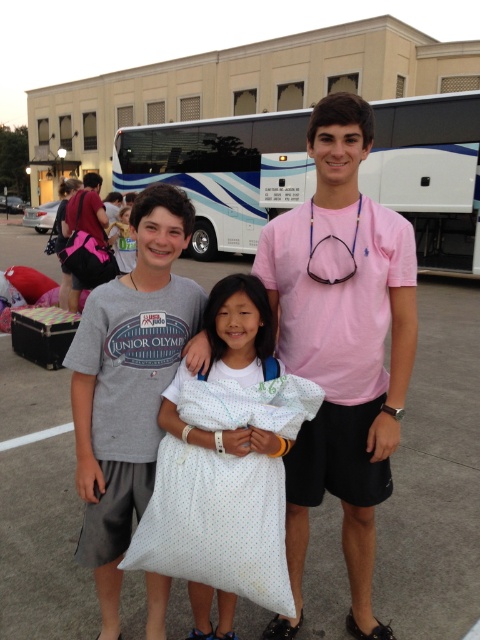
Question: Which of these objects is positioned closest to the pink cotton t-shirt at center?

Choices:
 (A) white dotted fabric bag at center
 (B) matte pink backpack at center

Answer: (A)

Question: Is white glossy bus at upper center thinner than white dotted fabric bag at center?

Choices:
 (A) yes
 (B) no

Answer: (B)

Question: Can you confirm if white dotted pillow at center is positioned to the left of pink cotton t-shirt at center?

Choices:
 (A) no
 (B) yes

Answer: (B)

Question: Which of the following is the closest to the observer?

Choices:
 (A) pink fabric backpack at left
 (B) white glossy bus at upper center
 (C) white dotted fabric bag at center
 (D) matte pink backpack at center

Answer: (C)

Question: Does gray cotton t-shirt at center appear on the right side of matte pink backpack at center?

Choices:
 (A) yes
 (B) no

Answer: (A)

Question: Which object appears farthest from the camera in this image?

Choices:
 (A) white dotted pillow at center
 (B) gray cotton t-shirt at center

Answer: (B)